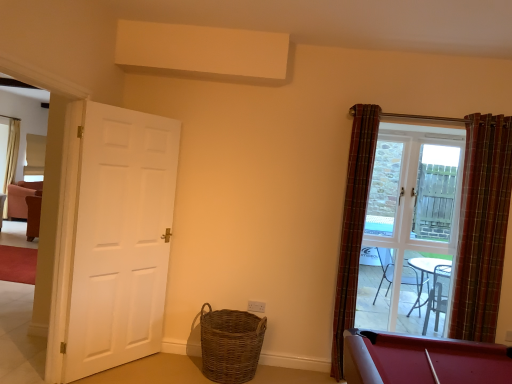
The image size is (512, 384). What do you see at coordinates (353, 224) in the screenshot? I see `plaid fabric curtain at right, the second curtain viewed from the right` at bounding box center [353, 224].

The height and width of the screenshot is (384, 512). What do you see at coordinates (230, 344) in the screenshot? I see `woven brown basket at lower center` at bounding box center [230, 344].

Where is `plaid fabric curtain at right, which is counted as the first curtain, starting from the right`? The width and height of the screenshot is (512, 384). plaid fabric curtain at right, which is counted as the first curtain, starting from the right is located at coordinates (482, 227).

Is plaid fabric curtain at right, placed as the 2th curtain when sorted from left to right, directly adjacent to woven brown basket at lower center?

plaid fabric curtain at right, placed as the 2th curtain when sorted from left to right, is not next to woven brown basket at lower center, and they're not touching.

From the image's perspective, is plaid fabric curtain at right, which is counted as the first curtain, starting from the right, beneath woven brown basket at lower center?

No.

Is point (495, 124) more distant than point (241, 318)?

No, it is not.

Is plaid fabric curtain at right, placed as the 2th curtain when sorted from left to right, located outside woven brown basket at lower center?

plaid fabric curtain at right, placed as the 2th curtain when sorted from left to right, is positioned outside woven brown basket at lower center.

Is the surface of plaid fabric curtain at right, which is counted as the first curtain, starting from the right, in direct contact with white matte door at left?

There is a gap between plaid fabric curtain at right, which is counted as the first curtain, starting from the right, and white matte door at left.

Which of these two, plaid fabric curtain at right, placed as the 2th curtain when sorted from left to right, or white matte door at left, stands shorter?

With less height is plaid fabric curtain at right, placed as the 2th curtain when sorted from left to right.

Is white matte door at left at the back of plaid fabric curtain at right, placed as the 2th curtain when sorted from left to right?

No, plaid fabric curtain at right, placed as the 2th curtain when sorted from left to right,'s orientation is not away from white matte door at left.

From the image's perspective, is plaid fabric curtain at right, placed as the 2th curtain when sorted from left to right, on top of white matte door at left?

Yes, from the image's perspective, plaid fabric curtain at right, placed as the 2th curtain when sorted from left to right, is over white matte door at left.

Where is `glass door located on the right of white matte door at left`? glass door located on the right of white matte door at left is located at coordinates (410, 229).

Can you confirm if clear glass door at right is bigger than white matte door at left?

No, clear glass door at right is not bigger than white matte door at left.

Based on the photo, between clear glass door at right and white matte door at left, which one has less height?

clear glass door at right.

Considering the relative sizes of clear glass door at right and white matte door at left in the image provided, is clear glass door at right thinner than white matte door at left?

Yes, clear glass door at right is thinner than white matte door at left.

Is clear glass door at right not close to plaid fabric curtain at right, which is counted as the first curtain, starting from the left?

They are positioned close to each other.

This screenshot has width=512, height=384. Find the location of `curtain below the clear glass door at right (from a real-world perspective)`. curtain below the clear glass door at right (from a real-world perspective) is located at coordinates (353, 224).

Is point (407, 188) positioned in front of point (373, 158)?

No, it is not.

Is clear glass door at right positioned with its back to plaid fabric curtain at right, which is counted as the first curtain, starting from the left?

clear glass door at right is not turned away from plaid fabric curtain at right, which is counted as the first curtain, starting from the left.

Considering the sizes of objects woven brown basket at lower center and clear glass door at right in the image provided, who is bigger, woven brown basket at lower center or clear glass door at right?

With larger size is woven brown basket at lower center.

Would you say woven brown basket at lower center is to the left or to the right of clear glass door at right in the picture?

Clearly, woven brown basket at lower center is on the left of clear glass door at right in the image.

Is woven brown basket at lower center with clear glass door at right?

No, woven brown basket at lower center is not touching clear glass door at right.

Does woven brown basket at lower center have a lesser width compared to clear glass door at right?

In fact, woven brown basket at lower center might be wider than clear glass door at right.

Would you say white matte door at left is to the left or to the right of woven brown basket at lower center in the picture?

Clearly, white matte door at left is on the left of woven brown basket at lower center in the image.

Is white matte door at left next to woven brown basket at lower center?

No, white matte door at left is not touching woven brown basket at lower center.

Does clear glass door at right appear on the right side of woven brown basket at lower center?

Indeed, clear glass door at right is positioned on the right side of woven brown basket at lower center.

Is clear glass door at right beside woven brown basket at lower center?

No, clear glass door at right is not in contact with woven brown basket at lower center.

At what (x,y) coordinates should I click in order to perform the action: click on glass door above the woven brown basket at lower center (from a real-world perspective). Please return your answer as a coordinate pair (x, y). Looking at the image, I should click on (410, 229).

Considering the positions of objects clear glass door at right and woven brown basket at lower center in the image provided, who is in front, clear glass door at right or woven brown basket at lower center?

woven brown basket at lower center.

From a real-world perspective, starting from the woven brown basket at lower center, which curtain is the 2nd one vertically above it? Please provide its 2D coordinates.

[(482, 227)]

Locate an element on the screen. door in front of the plaid fabric curtain at right, which is counted as the first curtain, starting from the right is located at coordinates (116, 238).

Which object lies further to the anchor point plaid fabric curtain at right, the second curtain viewed from the right, clear glass door at right or plaid fabric curtain at right, placed as the 2th curtain when sorted from left to right?

Among the two, plaid fabric curtain at right, placed as the 2th curtain when sorted from left to right, is located further to plaid fabric curtain at right, the second curtain viewed from the right.

Based on the photo, which object lies nearer to the anchor point plaid fabric curtain at right, which is counted as the first curtain, starting from the right, woven brown basket at lower center or clear glass door at right?

The object closer to plaid fabric curtain at right, which is counted as the first curtain, starting from the right, is clear glass door at right.

From the image, which object appears to be nearer to white matte door at left, plaid fabric curtain at right, which is counted as the first curtain, starting from the left, or woven brown basket at lower center?

woven brown basket at lower center is positioned closer to the anchor white matte door at left.

Which object lies further to the anchor point clear glass door at right, woven brown basket at lower center or white matte door at left?

white matte door at left lies further to clear glass door at right than the other object.

From the image, which object appears to be nearer to woven brown basket at lower center, white matte door at left or plaid fabric curtain at right, which is counted as the first curtain, starting from the left?

Among the two, white matte door at left is located nearer to woven brown basket at lower center.

Based on their spatial positions, is plaid fabric curtain at right, the second curtain viewed from the right, or white matte door at left further from woven brown basket at lower center?

The object further to woven brown basket at lower center is plaid fabric curtain at right, the second curtain viewed from the right.

Estimate the real-world distances between objects in this image. Which object is further from plaid fabric curtain at right, placed as the 2th curtain when sorted from left to right, plaid fabric curtain at right, the second curtain viewed from the right, or clear glass door at right?

Among the two, plaid fabric curtain at right, the second curtain viewed from the right, is located further to plaid fabric curtain at right, placed as the 2th curtain when sorted from left to right.

Which object lies nearer to the anchor point plaid fabric curtain at right, which is counted as the first curtain, starting from the right, clear glass door at right or white matte door at left?

clear glass door at right is positioned closer to the anchor plaid fabric curtain at right, which is counted as the first curtain, starting from the right.

Find the location of a particular element. The image size is (512, 384). curtain between white matte door at left and plaid fabric curtain at right, which is counted as the first curtain, starting from the right, from left to right is located at coordinates (353, 224).

Locate an element on the screen. This screenshot has width=512, height=384. basket between white matte door at left and clear glass door at right in the horizontal direction is located at coordinates (230, 344).

Where is `basket between white matte door at left and plaid fabric curtain at right, which is counted as the first curtain, starting from the left`? basket between white matte door at left and plaid fabric curtain at right, which is counted as the first curtain, starting from the left is located at coordinates (230, 344).

At what (x,y) coordinates should I click in order to perform the action: click on glass door situated between plaid fabric curtain at right, which is counted as the first curtain, starting from the left, and plaid fabric curtain at right, placed as the 2th curtain when sorted from left to right, from left to right. Please return your answer as a coordinate pair (x, y). Looking at the image, I should click on (410, 229).